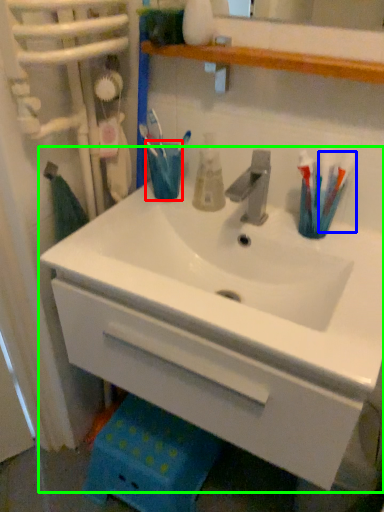
Question: Which object is the closest to the turquoise (highlighted by a red box)? Choose among these: toothbrush (highlighted by a blue box) or sink (highlighted by a green box).

Choices:
 (A) toothbrush
 (B) sink

Answer: (B)